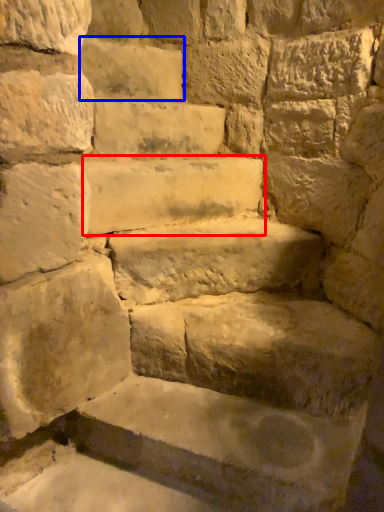
Question: Among these objects, which one is nearest to the camera, stone (highlighted by a red box) or brick (highlighted by a blue box)?

Choices:
 (A) stone
 (B) brick

Answer: (A)